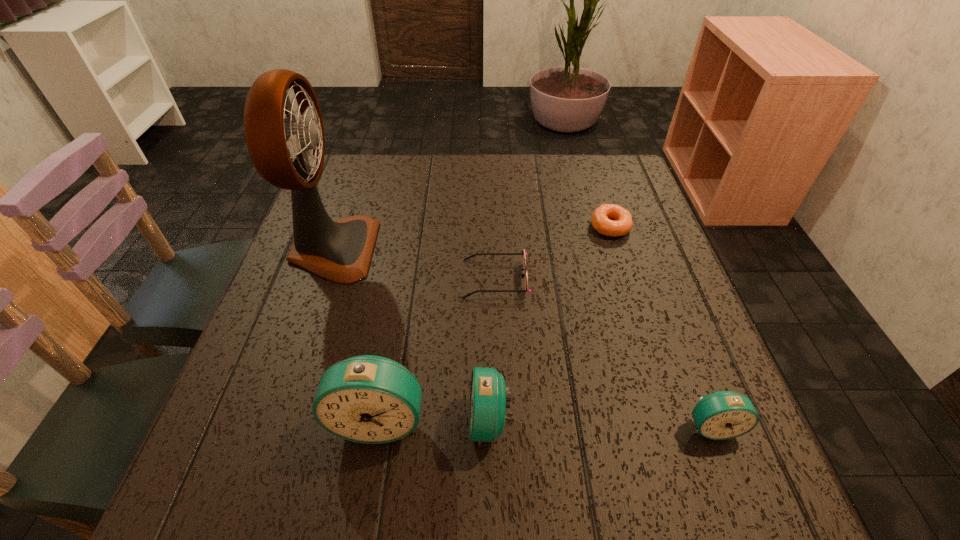
You are a GUI agent. You are given a task and a screenshot of the screen. Output one action in this format:
    pyautogui.click(x=<x>, y=<y>)
    Task: Click on the doughnut at the right edge
    The height and width of the screenshot is (540, 960).
    Given the screenshot: What is the action you would take?
    pyautogui.click(x=621, y=224)

Locate an element on the screen. object situated at the near right corner is located at coordinates tap(722, 415).

In order to click on vacant region at the far edge of the desktop in this screenshot , I will do `click(469, 158)`.

The width and height of the screenshot is (960, 540). In the image, there is a desktop. What are the coordinates of `vacant area at the near edge` in the screenshot? It's located at (570, 423).

Locate an element on the screen. The image size is (960, 540). free space at the left edge of the desktop is located at coordinates (360, 214).

Where is `vacant space at the right edge`? This screenshot has height=540, width=960. vacant space at the right edge is located at coordinates (714, 384).

Find the location of a particular element. The image size is (960, 540). vacant area at the far left corner of the desktop is located at coordinates (356, 168).

Where is `vacant space at the far right corner`? The width and height of the screenshot is (960, 540). vacant space at the far right corner is located at coordinates (621, 197).

I want to click on free region at the near right corner of the desktop, so click(x=662, y=441).

Locate an element on the screen. unoccupied area between the tallest object and the sunglasses is located at coordinates (415, 264).